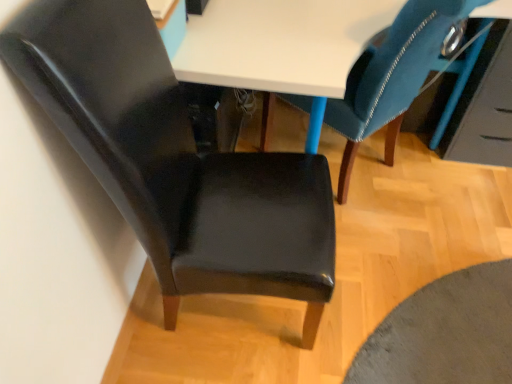
Locate an element on the screen. Image resolution: width=512 pixels, height=384 pixels. free spot in front of velvet blue chair at upper right, which is counted as the second chair, starting from the left is located at coordinates (409, 300).